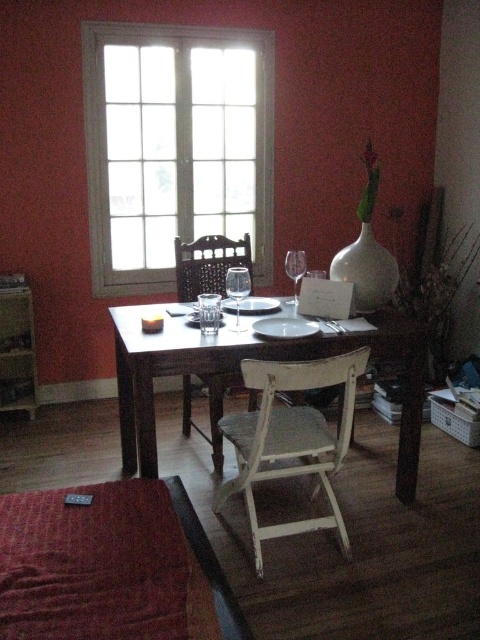
Does clear glass window at upper center have a greater width compared to white wood chair at center?

Yes, clear glass window at upper center is wider than white wood chair at center.

Can you confirm if clear glass window at upper center is shorter than white wood chair at center?

In fact, clear glass window at upper center may be taller than white wood chair at center.

Between point (257, 61) and point (247, 385), which one is positioned in front?

Point (247, 385)

You are a GUI agent. You are given a task and a screenshot of the screen. Output one action in this format:
    pyautogui.click(x=<x>, y=<y>)
    Task: Click on the clear glass window at upper center
    
    Given the screenshot: What is the action you would take?
    pyautogui.click(x=175, y=147)

Is point (133, 429) farther from viewer compared to point (240, 273)?

Yes, it is.

Does wooden table at center have a lesser width compared to transparent glass wine glass at table center?

In fact, wooden table at center might be wider than transparent glass wine glass at table center.

Find the location of a particular element. The width and height of the screenshot is (480, 640). wooden table at center is located at coordinates (239, 371).

The width and height of the screenshot is (480, 640). In order to click on wooden table at center in this screenshot , I will do `click(239, 371)`.

Is point (310, 452) closer to viewer compared to point (240, 298)?

Yes, point (310, 452) is closer to viewer.

Consider the image. Does white wood chair at center appear on the right side of transparent glass wine glass at table center?

Yes, white wood chair at center is to the right of transparent glass wine glass at table center.

Who is more forward, (321, 378) or (241, 328)?

Positioned in front is point (321, 378).

I want to click on white wood chair at center, so click(289, 438).